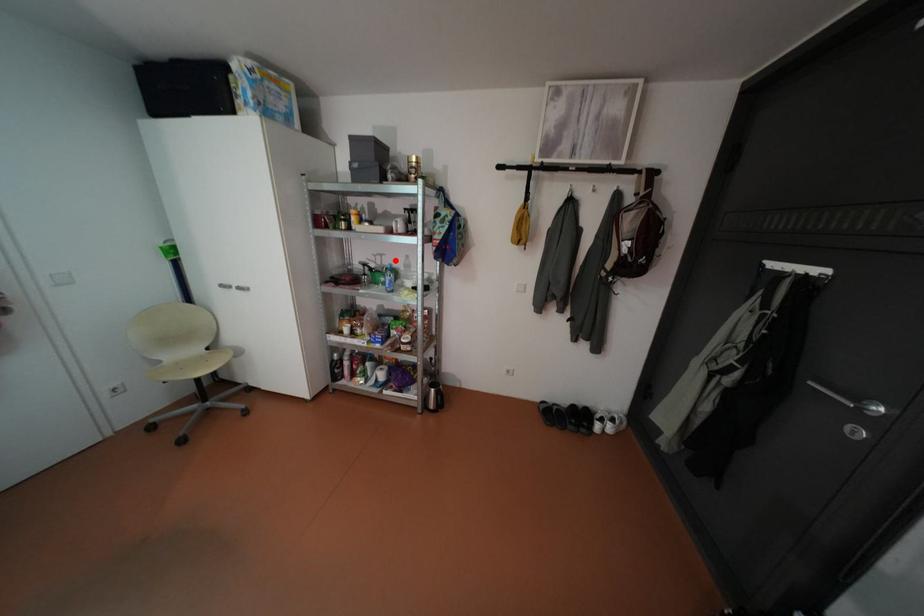
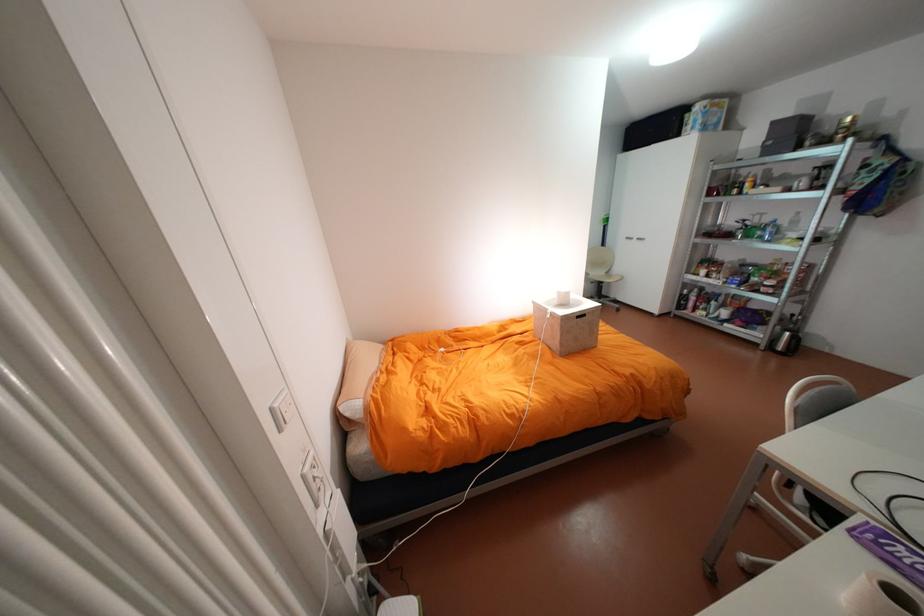
In the second image, find the point that corresponds to the highlighted location in the first image.

(775, 219)